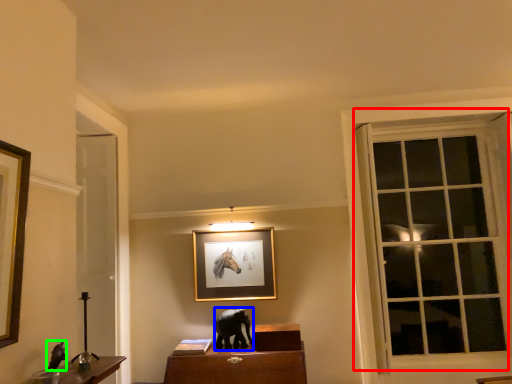
Question: Which object is the farthest from window (highlighted by a red box)? Choose among these: animal (highlighted by a blue box) or animal (highlighted by a green box).

Choices:
 (A) animal
 (B) animal

Answer: (B)